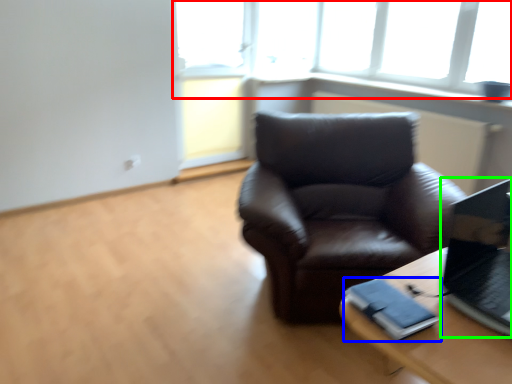
Question: Which is nearer to the window (highlighted by a red box)? binder (highlighted by a blue box) or laptop (highlighted by a green box).

Choices:
 (A) binder
 (B) laptop

Answer: (B)